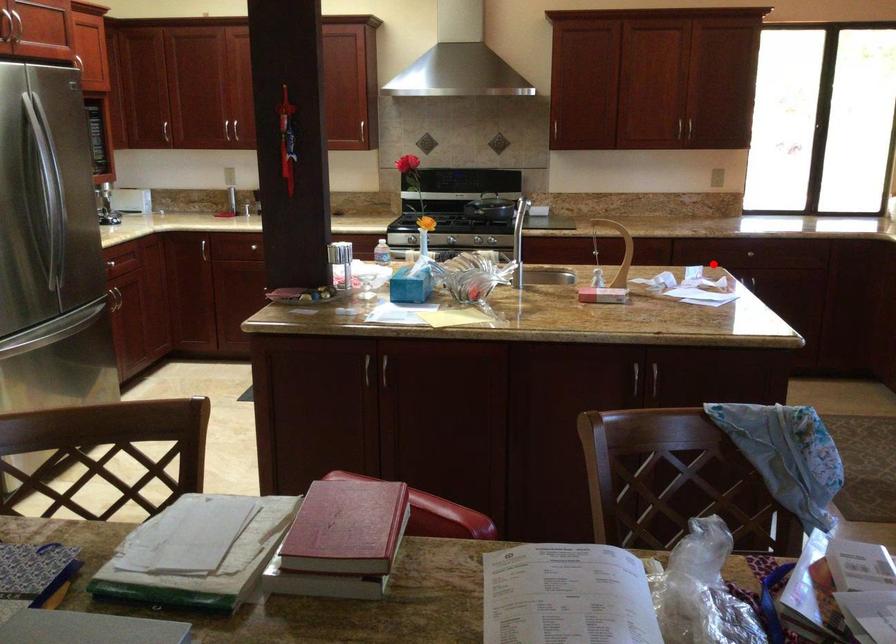
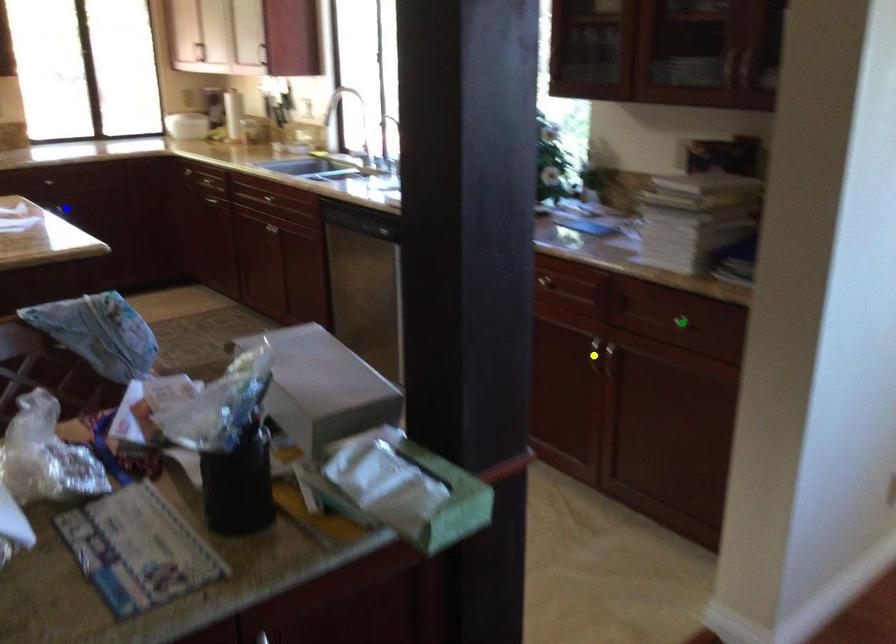
Question: I am providing you with two images of the same scene from different viewpoints. A red point is marked on the first image. You are given multiple points on the second image. In image 2, which mark is for the same physical point as the one in image 1?

Choices:
 (A) blue point
 (B) yellow point
 (C) green point

Answer: (A)